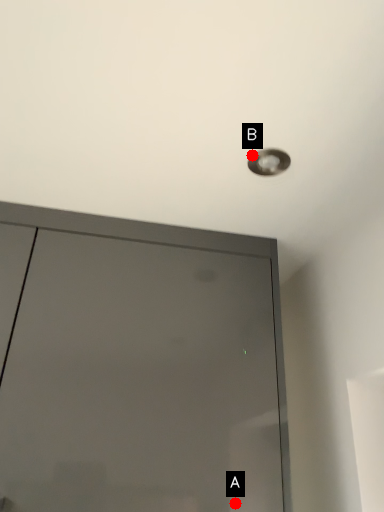
Question: Two points are circled on the image, labeled by A and B beside each circle. Which point is further to the camera?

Choices:
 (A) A is further
 (B) B is further

Answer: (B)